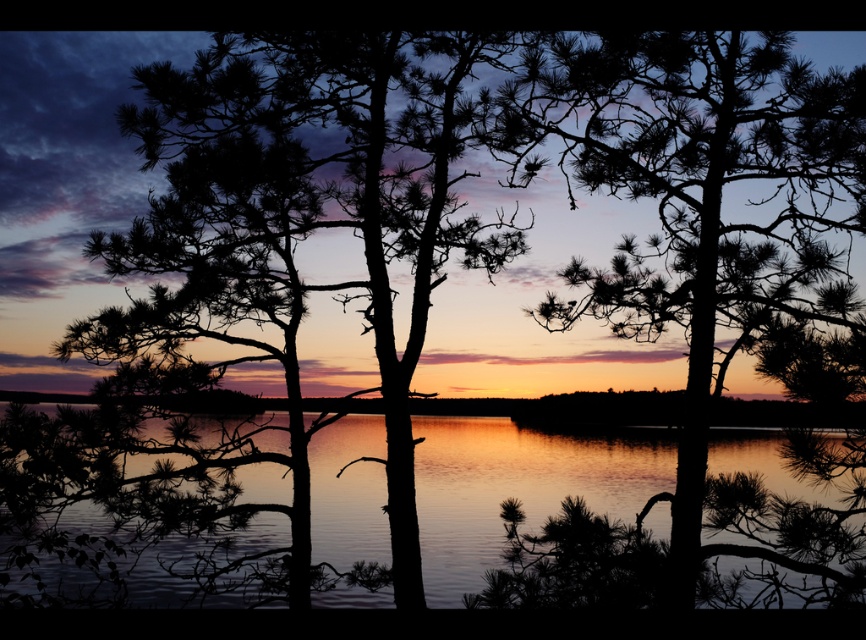
Who is more distant from viewer, (463, 474) or (634, 273)?

The point (634, 273) is more distant.

Is point (456, 452) farther from camera compared to point (725, 122)?

Yes, it is behind point (725, 122).

Does point (515, 488) lie behind point (832, 253)?

That is False.

Where is `reflective water at center`? This screenshot has height=640, width=866. reflective water at center is located at coordinates (134, 508).